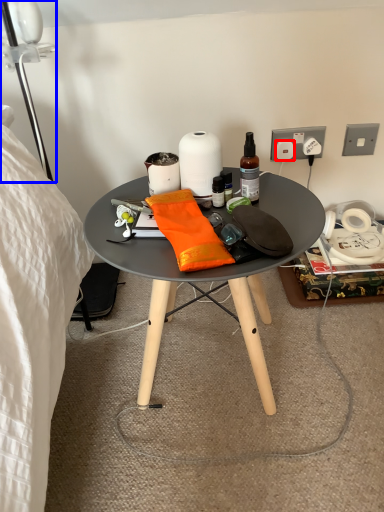
Question: Which object appears closest to the camera in this image, power outlet (highlighted by a red box) or lamp (highlighted by a blue box)?

Choices:
 (A) power outlet
 (B) lamp

Answer: (B)